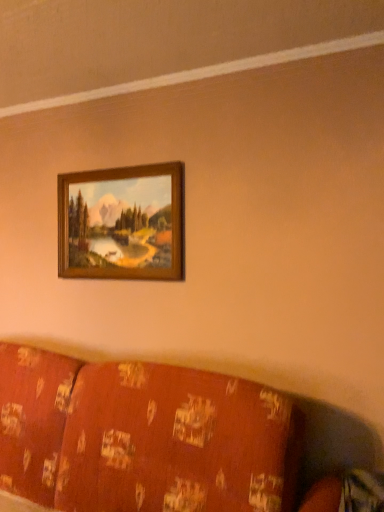
Question: Visually, is patterned fabric couch at lower center positioned to the left or to the right of wooden frame at upper center?

Choices:
 (A) left
 (B) right

Answer: (A)

Question: From a real-world perspective, is patterned fabric couch at lower center physically located above or below wooden frame at upper center?

Choices:
 (A) below
 (B) above

Answer: (A)

Question: Choose the correct answer: Is patterned fabric couch at lower center inside wooden frame at upper center or outside it?

Choices:
 (A) outside
 (B) inside

Answer: (A)

Question: From the image's perspective, relative to patterned fabric couch at lower center, is wooden frame at upper center above or below?

Choices:
 (A) above
 (B) below

Answer: (A)

Question: Choose the correct answer: Is wooden frame at upper center inside patterned fabric couch at lower center or outside it?

Choices:
 (A) inside
 (B) outside

Answer: (B)

Question: From a real-world perspective, is wooden frame at upper center physically located above or below patterned fabric couch at lower center?

Choices:
 (A) above
 (B) below

Answer: (A)

Question: Does point coord(81,256) appear closer or farther from the camera than point coord(167,481)?

Choices:
 (A) closer
 (B) farther

Answer: (B)